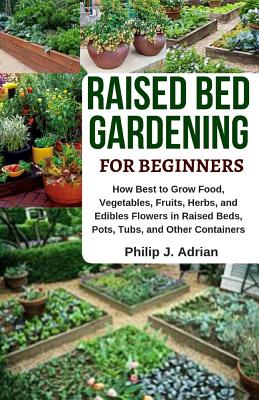
This screenshot has height=400, width=259. Find the location of `vase`. vase is located at coordinates (117, 54).